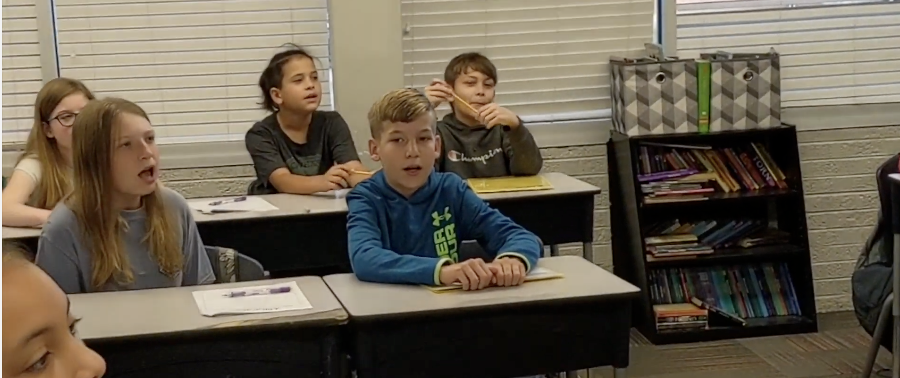
Locate an element on the screen. The width and height of the screenshot is (900, 378). window blinds is located at coordinates (200, 41), (544, 32), (864, 32).